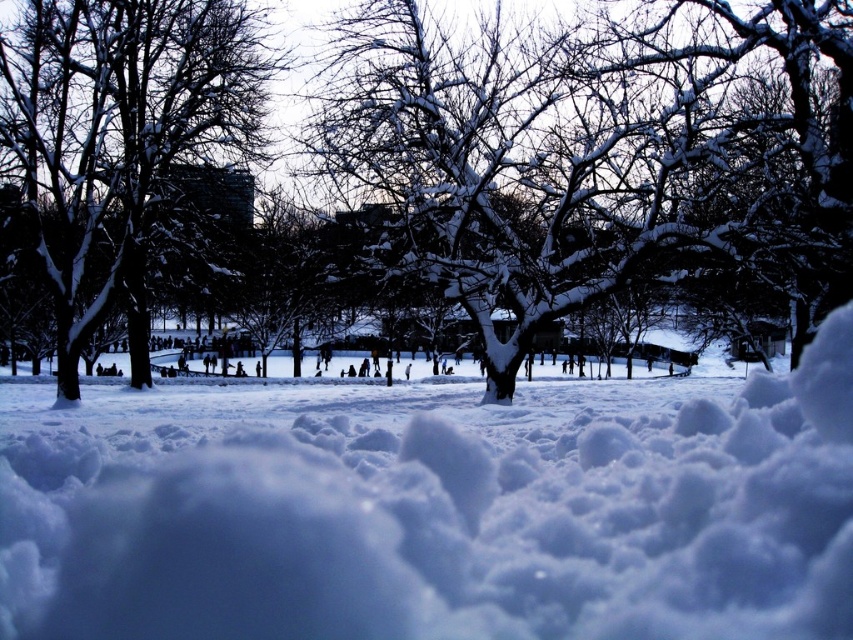
Question: Which of the following is the farthest from the observer?

Choices:
 (A) (172, 68)
 (B) (422, 189)
 (C) (26, 541)

Answer: (A)

Question: From the image, what is the correct spatial relationship of white fluffy snow at center in relation to snow-covered tree at center?

Choices:
 (A) right
 (B) left

Answer: (A)

Question: Is snow-covered branches at center below snow-covered tree at center?

Choices:
 (A) no
 (B) yes

Answer: (B)

Question: Which point is farther to the camera?

Choices:
 (A) snow-covered branches at center
 (B) white fluffy snow at center
 (C) snow-covered tree at center

Answer: (C)

Question: Which point is closer to the camera?

Choices:
 (A) (753, 28)
 (B) (405, 611)

Answer: (B)

Question: Is white fluffy snow at center wider than snow-covered branches at center?

Choices:
 (A) yes
 (B) no

Answer: (A)